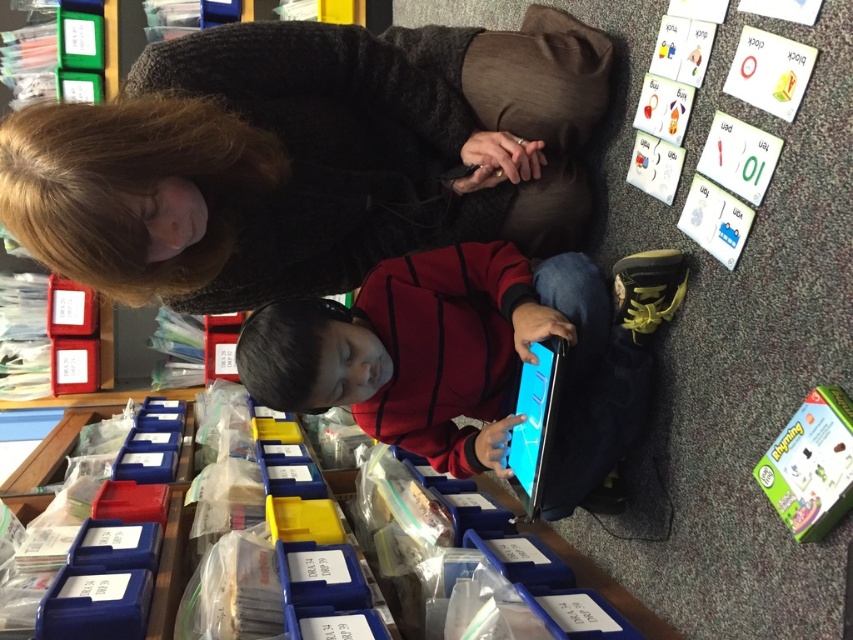
Question: Which point is farther to the camera?

Choices:
 (A) (291, 262)
 (B) (322, 400)

Answer: (A)

Question: Can you confirm if dark gray sweater at upper center is thinner than matte black tablet at center?

Choices:
 (A) yes
 (B) no

Answer: (B)

Question: Is smooth black tablet at center to the right of matte black tablet at center from the viewer's perspective?

Choices:
 (A) yes
 (B) no

Answer: (B)

Question: Can you confirm if smooth black tablet at center is wider than matte black tablet at center?

Choices:
 (A) no
 (B) yes

Answer: (B)

Question: Which of the following is the farthest from the observer?

Choices:
 (A) dark gray sweater at upper center
 (B) matte black tablet at center

Answer: (B)

Question: Among these objects, which one is nearest to the camera?

Choices:
 (A) smooth black tablet at center
 (B) dark gray sweater at upper center
 (C) matte black tablet at center

Answer: (B)